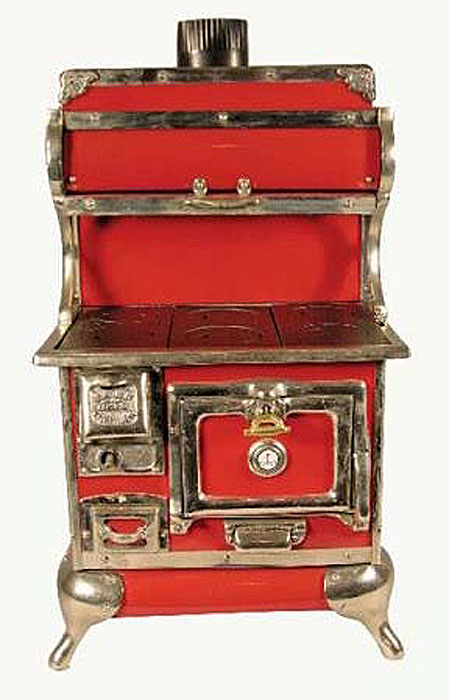
Locate an element on the screen. The width and height of the screenshot is (449, 700). corners is located at coordinates (434, 690), (13, 690), (38, 15), (439, 6).